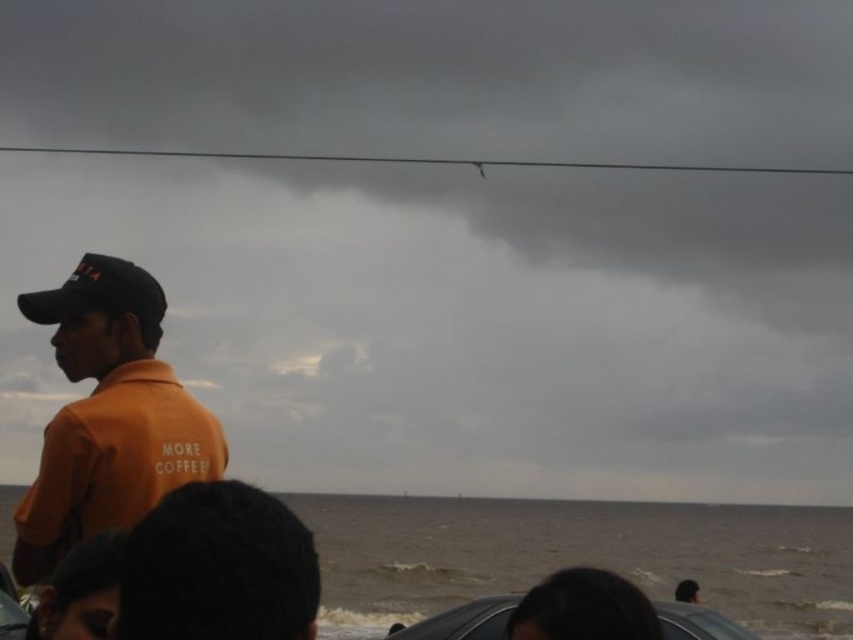
Is orange cotton shirt at left bigger than black matte baseball cap at left?

Yes, orange cotton shirt at left is bigger than black matte baseball cap at left.

Is orange cotton shirt at left taller than black matte baseball cap at left?

Correct, orange cotton shirt at left is much taller as black matte baseball cap at left.

This screenshot has height=640, width=853. What are the coordinates of `orange cotton shirt at left` in the screenshot? It's located at (218, 568).

At what (x,y) coordinates should I click in order to perform the action: click on orange cotton shirt at left. Please return your answer as a coordinate pair (x, y). Image resolution: width=853 pixels, height=640 pixels. Looking at the image, I should click on (218, 568).

Is orange matte shirt at left closer to camera compared to black matte baseball cap at left?

Yes, it is in front of black matte baseball cap at left.

You are a GUI agent. You are given a task and a screenshot of the screen. Output one action in this format:
    pyautogui.click(x=<x>, y=<y>)
    Task: Click on the orange matte shirt at left
    This screenshot has height=640, width=853.
    Given the screenshot: What is the action you would take?
    pyautogui.click(x=108, y=416)

Which of these two, orange matte shirt at left or orange cotton shirt at left, stands taller?

orange matte shirt at left is taller.

Is orange matte shirt at left positioned at the back of orange cotton shirt at left?

Yes, it is behind orange cotton shirt at left.

What do you see at coordinates (108, 416) in the screenshot? I see `orange matte shirt at left` at bounding box center [108, 416].

Identify the location of orange matte shirt at left. (108, 416).